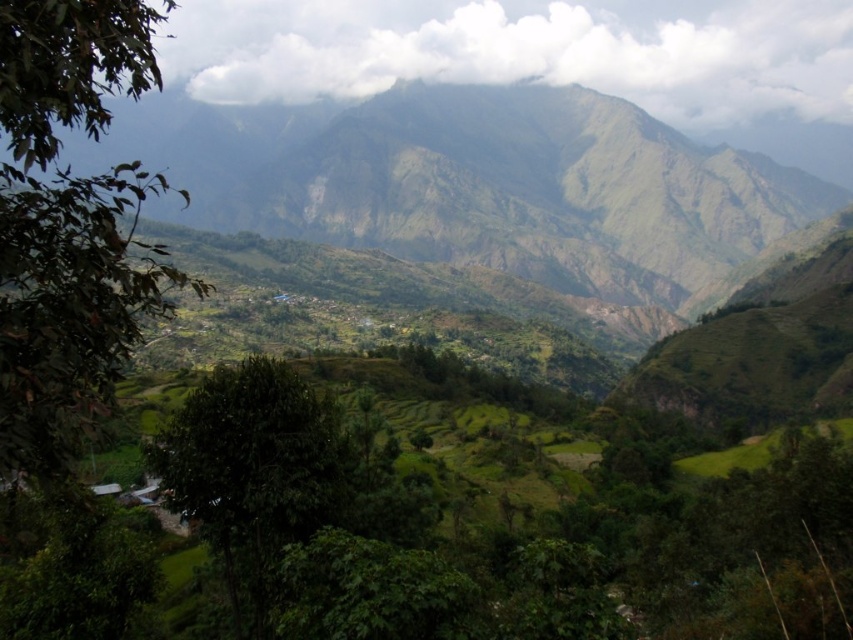
You are hiking in the valley and want to take a photo of both the green leafy tree at left and the green leafy tree at center. Which tree should you stand closer to in order to capture both in the same frame?

You should stand closer to the green leafy tree at center because the green leafy tree at left is positioned over it, meaning the tree at left is farther away. By moving closer to the closer tree, you can include both in your photo.

You are an environmental scientist studying the valley. You observe the green grassy mountain at center and the green leafy tree at center. Which object is located to the right of the other?

The green grassy mountain at center is positioned on the right side of green leafy tree at center.

From the picture: You are standing in the valley and want to walk from the green leafy tree at left to the green leafy tree at center. Which direction should you move relative to the trees?

To move from the green leafy tree at left to the green leafy tree at center, you should walk towards the right since the green leafy tree at center is located to the right of the green leafy tree at left.